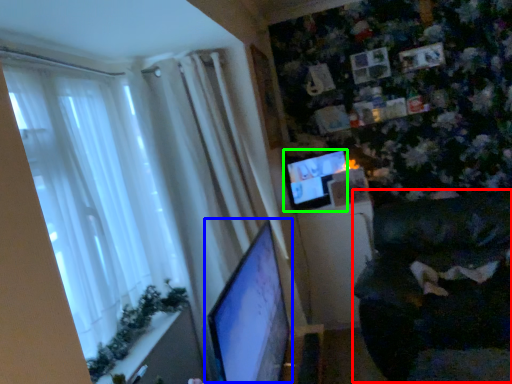
Question: Which is farther away from swivel chair (highlighted by a red box)? computer monitor (highlighted by a blue box) or computer monitor (highlighted by a green box)?

Choices:
 (A) computer monitor
 (B) computer monitor

Answer: (A)